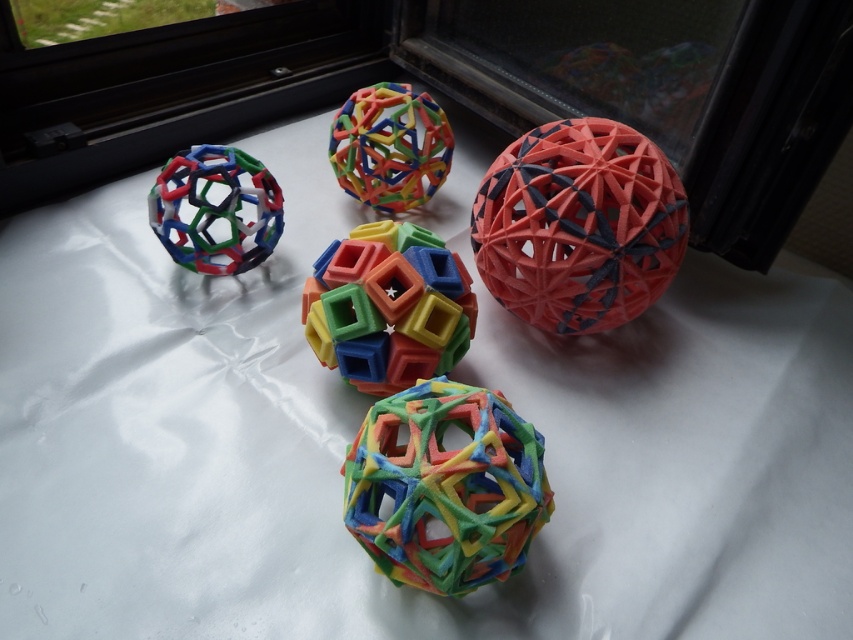
Which is more to the left, matte plastic ball at center or multicolored plastic cube at center?

Positioned to the left is multicolored plastic cube at center.

Which of these two, matte plastic ball at center or multicolored plastic cube at center, stands shorter?

multicolored plastic cube at center is shorter.

Between point (627, 259) and point (368, 227), which one is positioned in front?

Point (627, 259)

You are a GUI agent. You are given a task and a screenshot of the screen. Output one action in this format:
    pyautogui.click(x=<x>, y=<y>)
    Task: Click on the matte plastic ball at center
    
    Given the screenshot: What is the action you would take?
    coord(578,225)

Is the position of matte plastic ball at center more distant than that of multicolored plastic ball at left?

No, matte plastic ball at center is closer to the viewer.

Between matte plastic ball at center and multicolored plastic ball at left, which one is positioned lower?

matte plastic ball at center is lower down.

Image resolution: width=853 pixels, height=640 pixels. I want to click on matte plastic ball at center, so click(578, 225).

Which of these two, multicolored plastic cube at center or multicolored plastic ball at center, stands taller?

Standing taller between the two is multicolored plastic cube at center.

Locate an element on the screen. This screenshot has width=853, height=640. multicolored plastic cube at center is located at coordinates (387, 307).

Is point (415, 276) farther from camera compared to point (360, 157)?

No, (415, 276) is in front of (360, 157).

Find the location of a particular element. multicolored plastic cube at center is located at coordinates (387, 307).